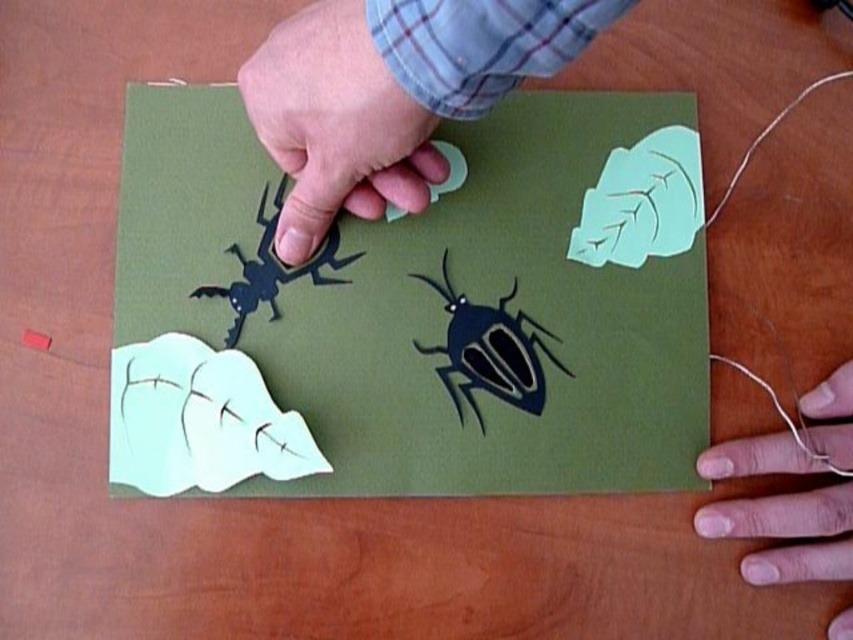
Which of these two, matte green paper at center or matte black beetle at center, stands shorter?

Standing shorter between the two is matte black beetle at center.

Is point (198, 387) closer to camera compared to point (419, 275)?

Yes, it is.

Which is behind, point (585, 116) or point (479, 413)?

Positioned behind is point (585, 116).

Identify the location of matte green paper at center. (415, 310).

What do you see at coordinates (415, 310) in the screenshot?
I see `matte green paper at center` at bounding box center [415, 310].

Does matte green paper at center have a greater height compared to black paper insect at upper left?

Indeed, matte green paper at center has a greater height compared to black paper insect at upper left.

What do you see at coordinates (415, 310) in the screenshot? The width and height of the screenshot is (853, 640). I see `matte green paper at center` at bounding box center [415, 310].

Where is `matte green paper at center`? matte green paper at center is located at coordinates (415, 310).

Based on the photo, can you confirm if matte paper hand at upper center is wider than smooth skin hand at lower right?

Correct, the width of matte paper hand at upper center exceeds that of smooth skin hand at lower right.

Does matte paper hand at upper center have a smaller size compared to smooth skin hand at lower right?

Actually, matte paper hand at upper center might be larger than smooth skin hand at lower right.

Where is `matte paper hand at upper center`? This screenshot has height=640, width=853. matte paper hand at upper center is located at coordinates (392, 93).